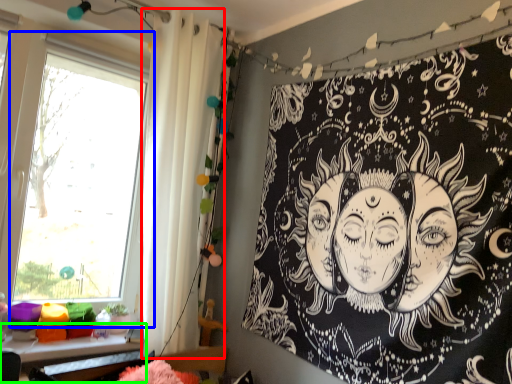
Question: Estimate the real-world distances between objects in this image. Which object is farther from shower curtain (highlighted by a red box), window (highlighted by a blue box) or table (highlighted by a green box)?

Choices:
 (A) window
 (B) table

Answer: (A)